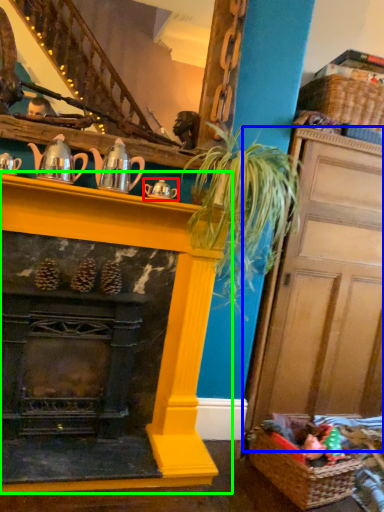
Question: Based on their relative distances, which object is nearer to tea pot (highlighted by a red box)? Choose from door (highlighted by a blue box) and fireplace (highlighted by a green box).

Choices:
 (A) door
 (B) fireplace

Answer: (B)